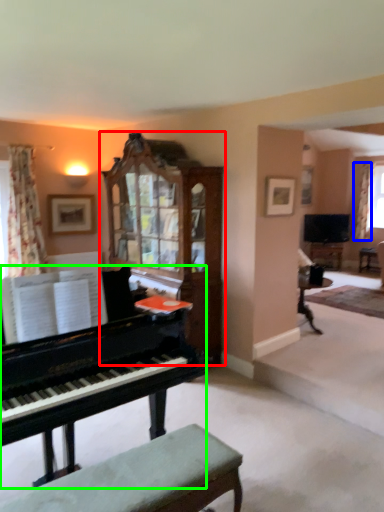
Question: Which is farther away from cabinetry (highlighted by a red box)? curtain (highlighted by a blue box) or piano (highlighted by a green box)?

Choices:
 (A) curtain
 (B) piano

Answer: (A)